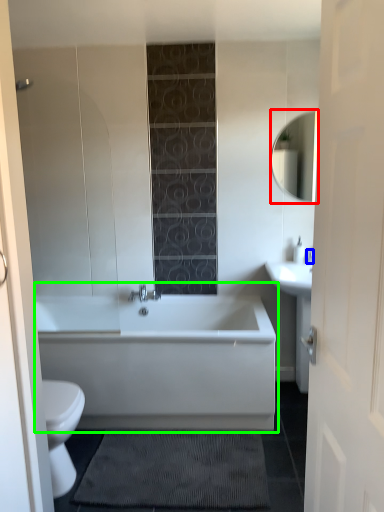
Question: Which is nearer to the mirror (highlighted by a red box)? faucet (highlighted by a blue box) or bathtub (highlighted by a green box).

Choices:
 (A) faucet
 (B) bathtub

Answer: (A)